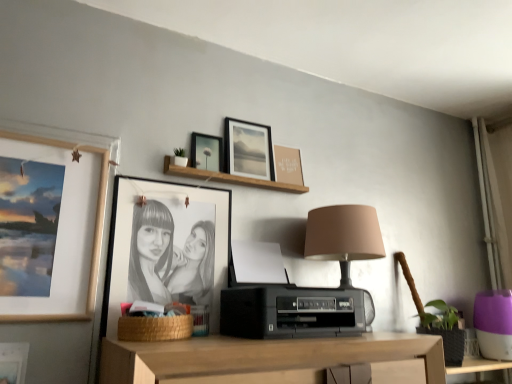
Question: From a real-world perspective, is matte black picture frame at upper center, the 3th picture frame in the right-to-left sequence, beneath matte brown picture frame at upper center, which appears as the 1th picture frame when viewed from the right?

Choices:
 (A) yes
 (B) no

Answer: (A)

Question: Considering the relative sizes of matte black picture frame at upper center, the 3th picture frame in the right-to-left sequence, and matte brown picture frame at upper center, which is counted as the sixth picture frame, starting from the left, in the image provided, is matte black picture frame at upper center, the 3th picture frame in the right-to-left sequence, wider than matte brown picture frame at upper center, which is counted as the sixth picture frame, starting from the left,?

Choices:
 (A) no
 (B) yes

Answer: (B)

Question: Considering the relative sizes of matte black picture frame at upper center, the 3th picture frame in the right-to-left sequence, and matte brown picture frame at upper center, which appears as the 1th picture frame when viewed from the right, in the image provided, is matte black picture frame at upper center, the 3th picture frame in the right-to-left sequence, taller than matte brown picture frame at upper center, which appears as the 1th picture frame when viewed from the right,?

Choices:
 (A) no
 (B) yes

Answer: (A)

Question: Is matte black picture frame at upper center, the 3th picture frame in the right-to-left sequence, located outside matte brown picture frame at upper center, which is counted as the sixth picture frame, starting from the left?

Choices:
 (A) no
 (B) yes

Answer: (B)

Question: From a real-world perspective, is matte black picture frame at upper center, the 4th picture frame from the left, physically above matte brown picture frame at upper center, which is counted as the sixth picture frame, starting from the left?

Choices:
 (A) no
 (B) yes

Answer: (A)

Question: Is matte black picture frame at upper center, arranged as the 5th picture frame when viewed from the left, inside the boundaries of wooden shelf at upper center, or outside?

Choices:
 (A) outside
 (B) inside

Answer: (A)

Question: Is matte black picture frame at upper center, which is counted as the 2th picture frame, starting from the right, wider or thinner than wooden shelf at upper center?

Choices:
 (A) wide
 (B) thin

Answer: (B)

Question: From the image's perspective, is matte black picture frame at upper center, arranged as the 5th picture frame when viewed from the left, above or below wooden shelf at upper center?

Choices:
 (A) above
 (B) below

Answer: (A)

Question: From a real-world perspective, relative to wooden shelf at upper center, is matte black picture frame at upper center, which is counted as the 2th picture frame, starting from the right, vertically above or below?

Choices:
 (A) below
 (B) above

Answer: (B)

Question: From a real-world perspective, is matte black picture frame at upper left, which ranks as the 6th picture frame in right-to-left order, above or below wooden shelf at upper center?

Choices:
 (A) below
 (B) above

Answer: (A)

Question: In terms of size, does matte black picture frame at upper left, which ranks as the 6th picture frame in right-to-left order, appear bigger or smaller than wooden shelf at upper center?

Choices:
 (A) small
 (B) big

Answer: (B)

Question: Is matte black picture frame at upper left, which ranks as the 6th picture frame in right-to-left order, taller or shorter than wooden shelf at upper center?

Choices:
 (A) short
 (B) tall

Answer: (B)

Question: Is matte black picture frame at upper left, which ranks as the 6th picture frame in right-to-left order, inside the boundaries of wooden shelf at upper center, or outside?

Choices:
 (A) inside
 (B) outside

Answer: (B)

Question: Looking at the image, does woven brown basket at lower center seem bigger or smaller compared to black matte picture frame at center, marked as the third picture frame in a left-to-right arrangement?

Choices:
 (A) small
 (B) big

Answer: (A)

Question: Does point (169, 321) appear closer or farther from the camera than point (168, 182)?

Choices:
 (A) farther
 (B) closer

Answer: (B)